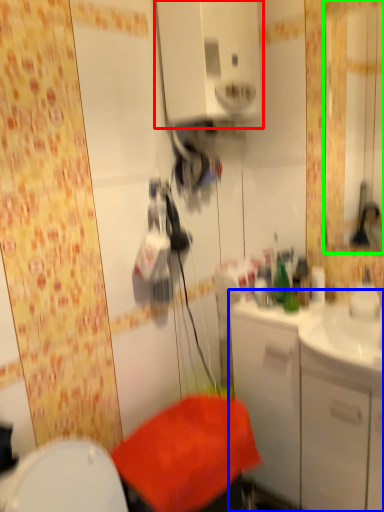
Question: Based on their relative distances, which object is farther from medicine cabinet (highlighted by a red box)? Choose from bathroom cabinet (highlighted by a blue box) and mirror (highlighted by a green box).

Choices:
 (A) bathroom cabinet
 (B) mirror

Answer: (B)